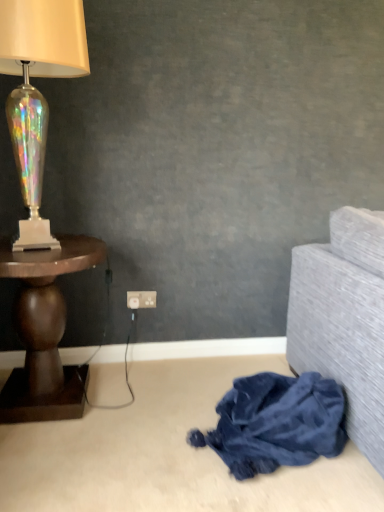
Question: Looking at the image, does velvety blue blanket at lower right seem bigger or smaller compared to iridescent glass lamp at left?

Choices:
 (A) small
 (B) big

Answer: (A)

Question: In the image, is velvety blue blanket at lower right positioned in front of or behind iridescent glass lamp at left?

Choices:
 (A) behind
 (B) front

Answer: (B)

Question: Considering the real-world distances, which object is farthest from the white plastic power outlet at center?

Choices:
 (A) velvety blue blanket at lower right
 (B) iridescent glass lamp at left
 (C) dark wood table at left

Answer: (B)

Question: Considering the real-world distances, which object is closest to the dark wood table at left?

Choices:
 (A) white plastic power outlet at center
 (B) iridescent glass lamp at left
 (C) velvety blue blanket at lower right

Answer: (B)